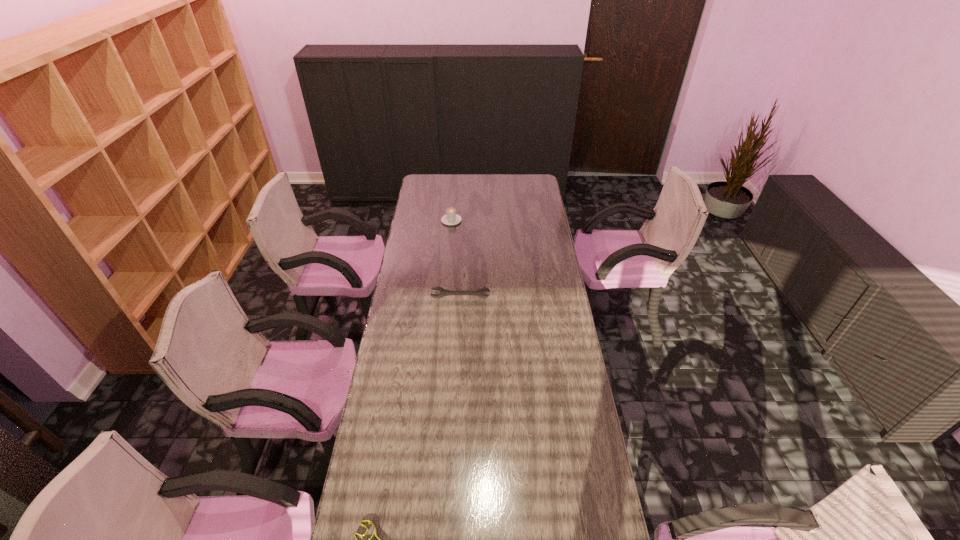
At what (x,y) coordinates should I click in order to perform the action: click on free space at the right edge of the desktop. Please return your answer as a coordinate pair (x, y). Looking at the image, I should click on (542, 258).

Where is `vacant space at the far left corner of the desktop`? The image size is (960, 540). vacant space at the far left corner of the desktop is located at coordinates (440, 184).

This screenshot has height=540, width=960. Find the location of `free region at the far right corner of the desktop`. free region at the far right corner of the desktop is located at coordinates (538, 194).

Find the location of `free space between the taller wrench and the farthest object`. free space between the taller wrench and the farthest object is located at coordinates (456, 259).

Find the location of a particular element. Image resolution: width=960 pixels, height=540 pixels. vacant area that lies between the second nearest object and the cappuccino is located at coordinates (456, 259).

Locate an element on the screen. The height and width of the screenshot is (540, 960). free space between the second nearest object and the farthest object is located at coordinates (456, 259).

Where is `vacant area that lies between the farthest object and the second nearest object`? The image size is (960, 540). vacant area that lies between the farthest object and the second nearest object is located at coordinates (456, 259).

In order to click on free space between the second farthest object and the farthest object in this screenshot , I will do `click(456, 259)`.

I want to click on vacant region between the taller wrench and the cappuccino, so click(x=456, y=259).

Identify which object is the second closest to the farther wrench. Please provide its 2D coordinates. Your answer should be formatted as a tuple, i.e. [(x, y)], where the tuple contains the x and y coordinates of a point satisfying the conditions above.

[(364, 521)]